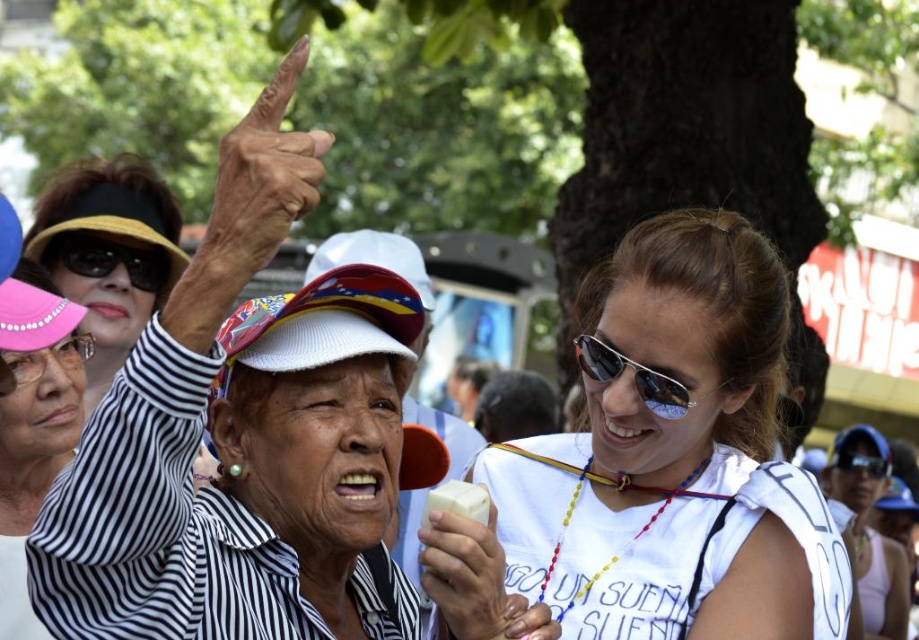
Which of these two, white matte ice cream at lower center or sunglasses at center, stands taller?

With more height is white matte ice cream at lower center.

Where is `white matte ice cream at lower center`? The height and width of the screenshot is (640, 919). white matte ice cream at lower center is located at coordinates (467, 577).

Is matte black visor at upper left bigger than white glossy tank top at center?

Correct, matte black visor at upper left is larger in size than white glossy tank top at center.

Is matte black visor at upper left shorter than white glossy tank top at center?

No.

Where is `matte black visor at upper left`? The width and height of the screenshot is (919, 640). matte black visor at upper left is located at coordinates (108, 252).

Image resolution: width=919 pixels, height=640 pixels. Describe the element at coordinates (870, 531) in the screenshot. I see `white glossy tank top at center` at that location.

Which is behind, point (880, 573) or point (588, 342)?

Point (880, 573)

This screenshot has height=640, width=919. What are the coordinates of `white glossy tank top at center` in the screenshot? It's located at (870, 531).